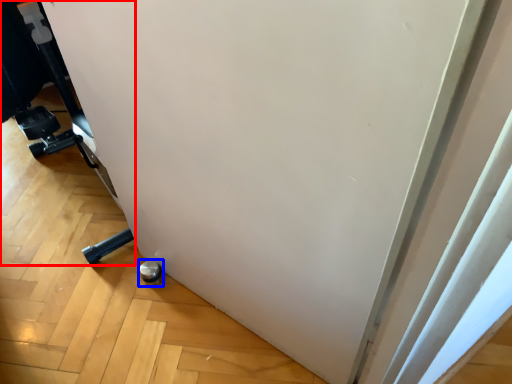
Question: Which object appears closest to the camera in this image, furniture (highlighted by a red box) or wheel (highlighted by a blue box)?

Choices:
 (A) furniture
 (B) wheel

Answer: (A)